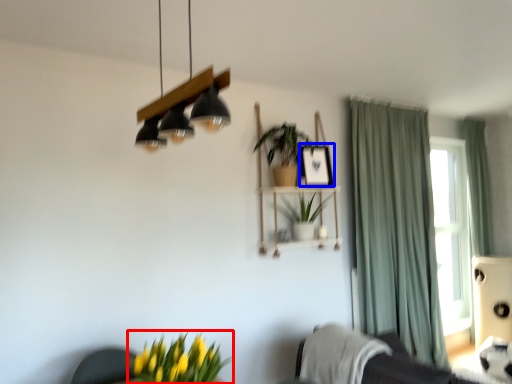
Question: Which object is closer to the camera taking this photo, houseplant (highlighted by a red box) or picture frame (highlighted by a blue box)?

Choices:
 (A) houseplant
 (B) picture frame

Answer: (A)